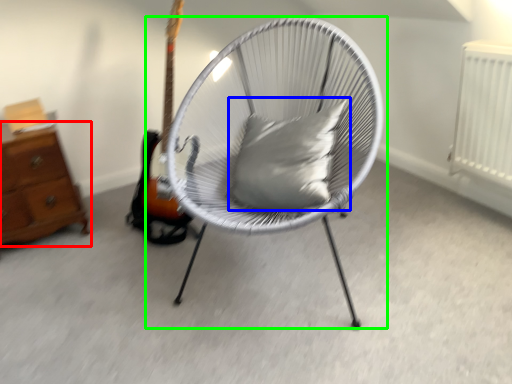
Question: Which is farther away from chest of drawers (highlighted by a red box)? pillow (highlighted by a blue box) or chair (highlighted by a green box)?

Choices:
 (A) pillow
 (B) chair

Answer: (A)